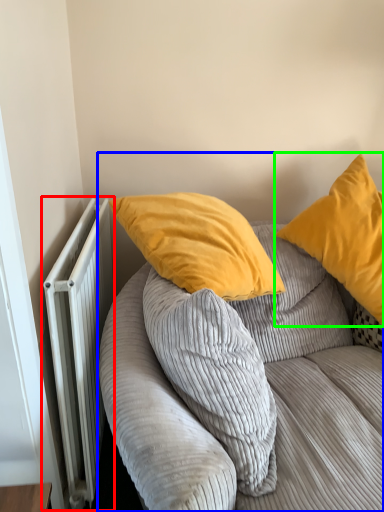
Question: Considering the real-world distances, which object is closest to radiator (highlighted by a red box)? studio couch (highlighted by a blue box) or pillow (highlighted by a green box).

Choices:
 (A) studio couch
 (B) pillow

Answer: (A)